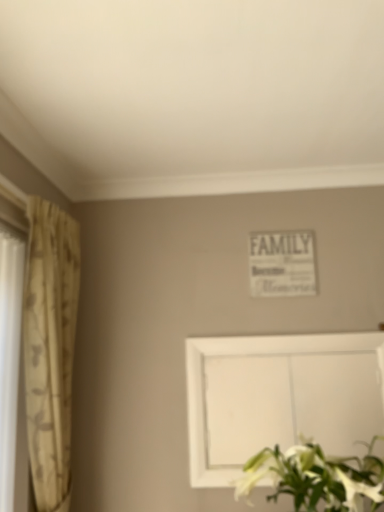
Question: From the image's perspective, is white matte floral arrangement at lower right on white matte picture frame at lower center?

Choices:
 (A) no
 (B) yes

Answer: (A)

Question: Is the depth of white matte floral arrangement at lower right less than that of white matte picture frame at lower center?

Choices:
 (A) no
 (B) yes

Answer: (B)

Question: Does white matte floral arrangement at lower right come behind white matte picture frame at lower center?

Choices:
 (A) yes
 (B) no

Answer: (B)

Question: From a real-world perspective, is white matte floral arrangement at lower right below white matte picture frame at lower center?

Choices:
 (A) yes
 (B) no

Answer: (A)

Question: Is white matte floral arrangement at lower right thinner than white matte picture frame at lower center?

Choices:
 (A) no
 (B) yes

Answer: (A)

Question: Is point (382, 486) positioned closer to the camera than point (41, 398)?

Choices:
 (A) closer
 (B) farther

Answer: (A)

Question: From the image's perspective, is white matte floral arrangement at lower right above or below beige floral fabric curtain at left?

Choices:
 (A) below
 (B) above

Answer: (A)

Question: Looking at their shapes, would you say white matte floral arrangement at lower right is wider or thinner than beige floral fabric curtain at left?

Choices:
 (A) thin
 (B) wide

Answer: (B)

Question: Is white matte floral arrangement at lower right inside or outside of beige floral fabric curtain at left?

Choices:
 (A) inside
 (B) outside

Answer: (B)

Question: From a real-world perspective, is white matte picture frame at lower center above or below beige floral fabric curtain at left?

Choices:
 (A) below
 (B) above

Answer: (A)

Question: Based on their sizes in the image, would you say white matte picture frame at lower center is bigger or smaller than beige floral fabric curtain at left?

Choices:
 (A) small
 (B) big

Answer: (A)

Question: Looking at their shapes, would you say white matte picture frame at lower center is wider or thinner than beige floral fabric curtain at left?

Choices:
 (A) wide
 (B) thin

Answer: (B)

Question: Considering the positions of point (347, 437) and point (39, 292), is point (347, 437) closer or farther from the camera than point (39, 292)?

Choices:
 (A) farther
 (B) closer

Answer: (A)

Question: Is point 43,395 positioned closer to the camera than point 306,453?

Choices:
 (A) closer
 (B) farther

Answer: (B)

Question: Relative to white matte floral arrangement at lower right, is beige floral fabric curtain at left in front or behind?

Choices:
 (A) front
 (B) behind

Answer: (B)